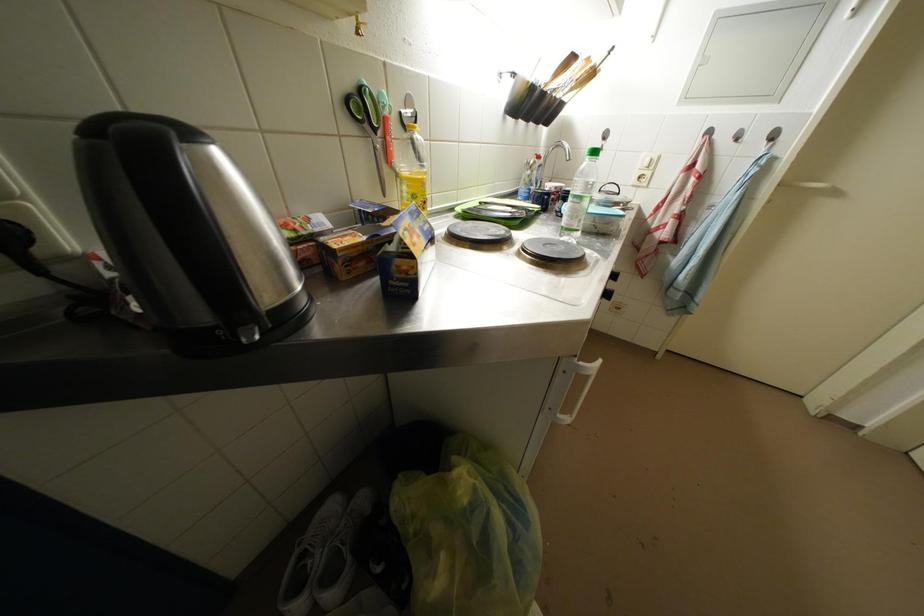
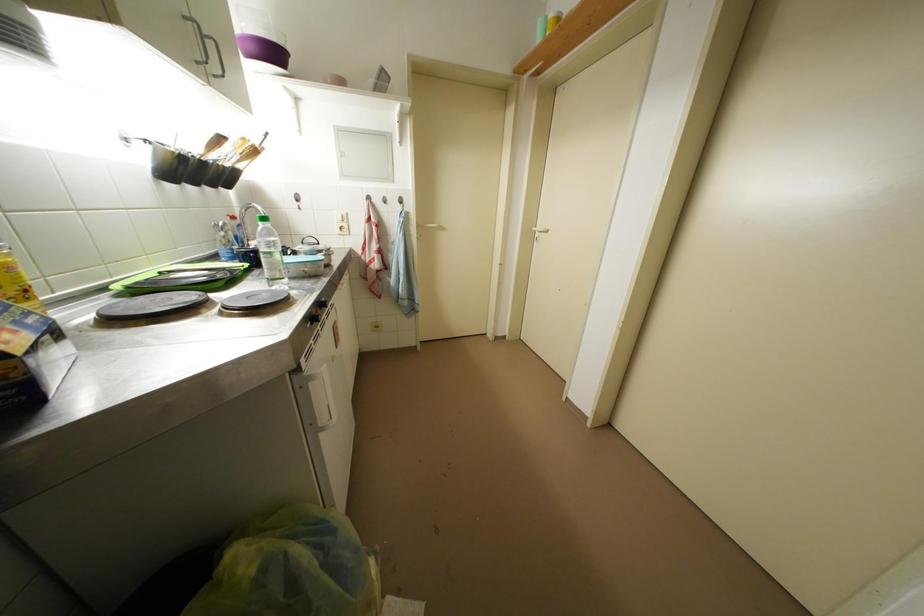
Question: How did the camera likely rotate?

Choices:
 (A) Left
 (B) Right
 (C) Up
 (D) Down

Answer: (B)